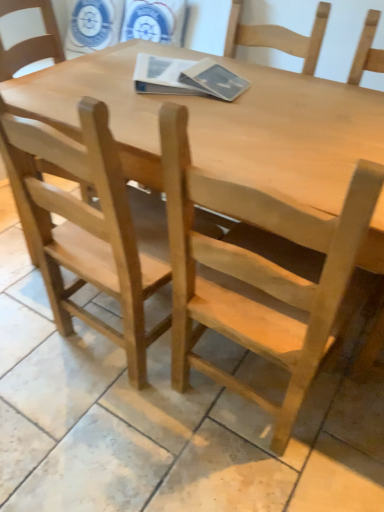
Question: Does natural wood chair at left, the 2th chair viewed from the right, have a greater width compared to natural wood chair at center, placed as the first chair when sorted from right to left?

Choices:
 (A) no
 (B) yes

Answer: (B)

Question: Does natural wood chair at left, the 2th chair viewed from the right, have a larger size compared to natural wood chair at center, placed as the first chair when sorted from right to left?

Choices:
 (A) no
 (B) yes

Answer: (B)

Question: Is natural wood chair at left, the 2th chair viewed from the right, touching natural wood chair at center, placed as the first chair when sorted from right to left?

Choices:
 (A) yes
 (B) no

Answer: (B)

Question: Is natural wood chair at left, the 2th chair viewed from the right, thinner than natural wood chair at center, placed as the first chair when sorted from right to left?

Choices:
 (A) yes
 (B) no

Answer: (B)

Question: Is natural wood chair at left, the 1th chair in the left-to-right sequence, at the left side of natural wood chair at center, the second chair from the left?

Choices:
 (A) no
 (B) yes

Answer: (B)

Question: From the image's perspective, is natural wood table at center located above or below natural wood chair at center, placed as the first chair when sorted from right to left?

Choices:
 (A) below
 (B) above

Answer: (B)

Question: Considering the relative positions of natural wood table at center and natural wood chair at center, placed as the first chair when sorted from right to left, in the image provided, is natural wood table at center to the left or to the right of natural wood chair at center, placed as the first chair when sorted from right to left,?

Choices:
 (A) left
 (B) right

Answer: (A)

Question: Considering the positions of natural wood table at center and natural wood chair at center, the second chair from the left, in the image, is natural wood table at center taller or shorter than natural wood chair at center, the second chair from the left,?

Choices:
 (A) tall
 (B) short

Answer: (B)

Question: Is natural wood table at center inside the boundaries of natural wood chair at center, the second chair from the left, or outside?

Choices:
 (A) outside
 (B) inside

Answer: (A)

Question: Considering the relative positions of natural wood chair at left, the 2th chair viewed from the right, and natural wood chair at center, the second chair from the left, in the image provided, is natural wood chair at left, the 2th chair viewed from the right, to the left or to the right of natural wood chair at center, the second chair from the left,?

Choices:
 (A) left
 (B) right

Answer: (A)

Question: In the image, is natural wood chair at left, the 1th chair in the left-to-right sequence, positioned in front of or behind natural wood chair at center, the second chair from the left?

Choices:
 (A) behind
 (B) front

Answer: (A)

Question: Based on their sizes in the image, would you say natural wood chair at left, the 1th chair in the left-to-right sequence, is bigger or smaller than natural wood chair at center, the second chair from the left?

Choices:
 (A) small
 (B) big

Answer: (B)

Question: From a real-world perspective, is natural wood chair at left, the 1th chair in the left-to-right sequence, above or below natural wood chair at center, the second chair from the left?

Choices:
 (A) below
 (B) above

Answer: (A)

Question: Considering the positions of point (244, 315) and point (77, 154), is point (244, 315) closer or farther from the camera than point (77, 154)?

Choices:
 (A) closer
 (B) farther

Answer: (B)

Question: Considering the positions of natural wood chair at center, placed as the first chair when sorted from right to left, and natural wood chair at left, the 1th chair in the left-to-right sequence, in the image, is natural wood chair at center, placed as the first chair when sorted from right to left, taller or shorter than natural wood chair at left, the 1th chair in the left-to-right sequence,?

Choices:
 (A) tall
 (B) short

Answer: (B)